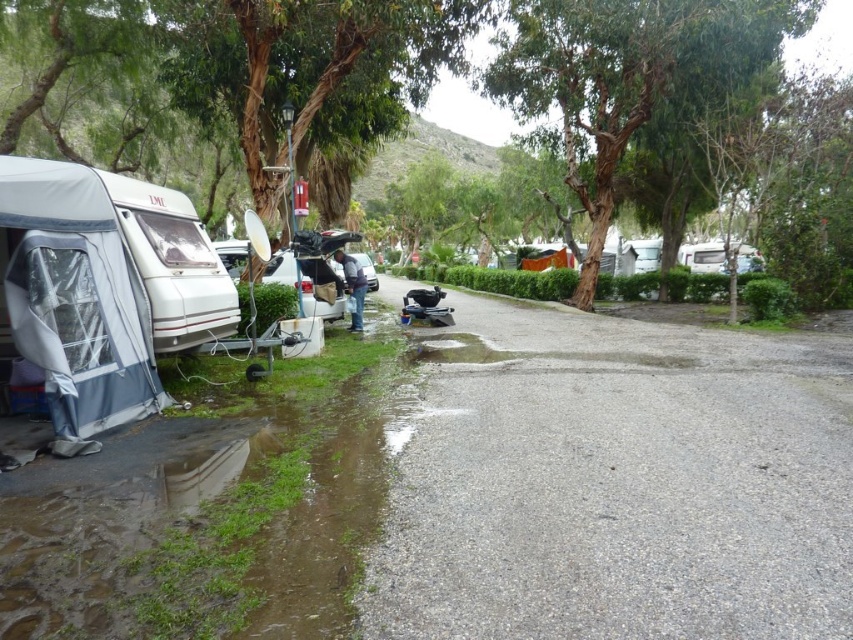
Who is positioned more to the left, white fabric tent at left or metallic silver car at center?

white fabric tent at left

Is point (209, 250) more distant than point (370, 276)?

That is False.

Is point (107, 252) in front of point (373, 273)?

Yes, point (107, 252) is in front of point (373, 273).

Find the location of a particular element. This screenshot has height=640, width=853. white fabric tent at left is located at coordinates 102,288.

Does green rough bark tree at upper center have a larger size compared to metallic silver car at center?

Yes, green rough bark tree at upper center is bigger than metallic silver car at center.

Is green rough bark tree at upper center above metallic silver car at center?

Indeed, green rough bark tree at upper center is positioned over metallic silver car at center.

Is point (685, 13) positioned in front of point (360, 257)?

Yes.

The width and height of the screenshot is (853, 640). Identify the location of green rough bark tree at upper center. (x=628, y=77).

Is white fabric tent at left to the right of green rough bark tree at upper center from the viewer's perspective?

No, white fabric tent at left is not to the right of green rough bark tree at upper center.

This screenshot has width=853, height=640. In order to click on white fabric tent at left in this screenshot , I will do `click(102, 288)`.

Which is behind, point (138, 365) or point (605, 61)?

The point (605, 61) is behind.

The width and height of the screenshot is (853, 640). I want to click on white fabric tent at left, so click(x=102, y=288).